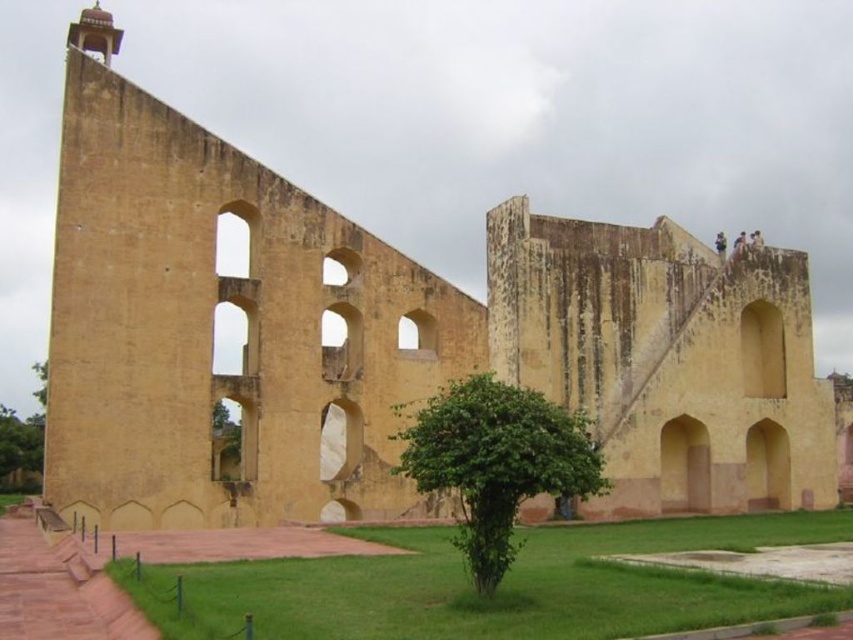
Question: Is green leafy tree at center above green leafy tree at lower left?

Choices:
 (A) no
 (B) yes

Answer: (B)

Question: Which point is farther to the camera?

Choices:
 (A) (0, 465)
 (B) (590, 483)

Answer: (A)

Question: Which of the following is the closest to the observer?

Choices:
 (A) green leafy tree at lower left
 (B) green leafy tree at center

Answer: (B)

Question: Is green leafy tree at center positioned behind green leafy tree at lower left?

Choices:
 (A) yes
 (B) no

Answer: (B)

Question: Which object appears closest to the camera in this image?

Choices:
 (A) green leafy tree at center
 (B) green leafy tree at lower left

Answer: (A)

Question: Is green leafy tree at center thinner than green leafy tree at lower left?

Choices:
 (A) no
 (B) yes

Answer: (B)